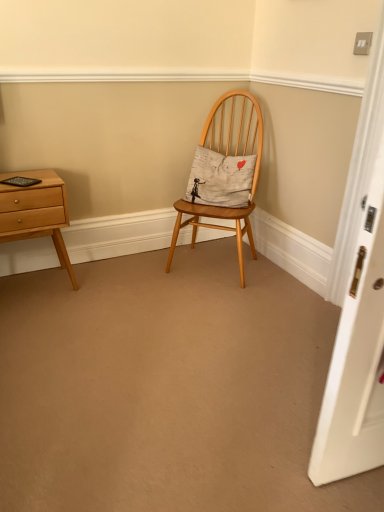
Find the location of a particular element. light brown wood nightstand at left is located at coordinates (36, 212).

What do you see at coordinates (36, 212) in the screenshot? I see `light brown wood nightstand at left` at bounding box center [36, 212].

I want to click on white cotton cushion at center, so click(220, 179).

Is white cotton cushion at center thinner than natural wood chair at center?

Indeed, white cotton cushion at center has a lesser width compared to natural wood chair at center.

Image resolution: width=384 pixels, height=512 pixels. I want to click on chair that appears on the right of white cotton cushion at center, so pyautogui.click(x=225, y=170).

Considering the relative sizes of white cotton cushion at center and natural wood chair at center in the image provided, is white cotton cushion at center taller than natural wood chair at center?

Result: Incorrect, the height of white cotton cushion at center is not larger of that of natural wood chair at center.

Is white cotton cushion at center not near natural wood chair at center?

No, white cotton cushion at center is not far from natural wood chair at center.

How distant is natural wood chair at center from white cotton cushion at center?

They are 3.32 inches apart.

Can you tell me how much natural wood chair at center and white cotton cushion at center differ in facing direction?

The angular difference between natural wood chair at center and white cotton cushion at center is 1.88 degrees.

Considering their positions, is natural wood chair at center located in front of or behind white cotton cushion at center?

Clearly, natural wood chair at center is in front of white cotton cushion at center.

Which is further, (198,192) or (246,170)?

Positioned behind is point (246,170).

Considering the sizes of natural wood chair at center and light brown wood nightstand at left in the image, is natural wood chair at center taller or shorter than light brown wood nightstand at left?

Considering their sizes, natural wood chair at center has more height than light brown wood nightstand at left.

Is natural wood chair at center facing away from light brown wood nightstand at left?

That's not correct — natural wood chair at center is not looking away from light brown wood nightstand at left.

In the scene shown: From the image's perspective, which one is positioned higher, natural wood chair at center or light brown wood nightstand at left?

From the image's view, natural wood chair at center is above.

Choose the correct answer: Is natural wood chair at center inside light brown wood nightstand at left or outside it?

natural wood chair at center is spatially situated outside light brown wood nightstand at left.

Image resolution: width=384 pixels, height=512 pixels. Find the location of `pillow on the right of light brown wood nightstand at left`. pillow on the right of light brown wood nightstand at left is located at coordinates (220, 179).

How many degrees apart are the facing directions of white cotton cushion at center and light brown wood nightstand at left?

46.8 degrees.

Does white cotton cushion at center have a greater width compared to light brown wood nightstand at left?

No.

Can you confirm if white cotton cushion at center is bigger than light brown wood nightstand at left?

No.

Does light brown wood nightstand at left have a larger size compared to natural wood chair at center?

Actually, light brown wood nightstand at left might be smaller than natural wood chair at center.

From their relative heights in the image, would you say light brown wood nightstand at left is taller or shorter than natural wood chair at center?

In the image, light brown wood nightstand at left appears to be shorter than natural wood chair at center.

From a real-world perspective, is light brown wood nightstand at left positioned above or below natural wood chair at center?

From a real-world perspective, light brown wood nightstand at left is physically below natural wood chair at center.

Is light brown wood nightstand at left located outside white cotton cushion at center?

Absolutely, light brown wood nightstand at left is external to white cotton cushion at center.

Is the position of light brown wood nightstand at left more distant than that of white cotton cushion at center?

No, it is in front of white cotton cushion at center.

From a real-world perspective, which object stands above the other?

white cotton cushion at center, from a real-world perspective.

From the image's perspective, is light brown wood nightstand at left located above or below white cotton cushion at center?

Based on their image positions, light brown wood nightstand at left is located beneath white cotton cushion at center.

Image resolution: width=384 pixels, height=512 pixels. Find the location of `pillow above the natural wood chair at center (from the image's perspective)`. pillow above the natural wood chair at center (from the image's perspective) is located at coordinates point(220,179).

At what (x,y) coordinates should I click in order to perform the action: click on pillow located on the left of natural wood chair at center. Please return your answer as a coordinate pair (x, y). Looking at the image, I should click on (220, 179).

Based on their spatial positions, is light brown wood nightstand at left or white cotton cushion at center closer to natural wood chair at center?

white cotton cushion at center lies closer to natural wood chair at center than the other object.

Estimate the real-world distances between objects in this image. Which object is closer to white cotton cushion at center, natural wood chair at center or light brown wood nightstand at left?

The object closer to white cotton cushion at center is natural wood chair at center.

Which object lies further to the anchor point natural wood chair at center, white cotton cushion at center or light brown wood nightstand at left?

Based on the image, light brown wood nightstand at left appears to be further to natural wood chair at center.

Estimate the real-world distances between objects in this image. Which object is further from light brown wood nightstand at left, natural wood chair at center or white cotton cushion at center?

Among the two, white cotton cushion at center is located further to light brown wood nightstand at left.

Estimate the real-world distances between objects in this image. Which object is further from white cotton cushion at center, light brown wood nightstand at left or natural wood chair at center?

light brown wood nightstand at left.

Considering their positions, is white cotton cushion at center positioned further to light brown wood nightstand at left than natural wood chair at center?

The object further to light brown wood nightstand at left is white cotton cushion at center.

Where is `pillow situated between light brown wood nightstand at left and natural wood chair at center from left to right`? The image size is (384, 512). pillow situated between light brown wood nightstand at left and natural wood chair at center from left to right is located at coordinates (220, 179).